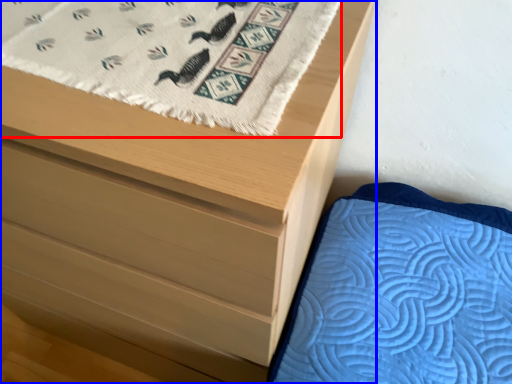
Question: Among these objects, which one is farthest to the camera, blanket (highlighted by a red box) or chest of drawers (highlighted by a blue box)?

Choices:
 (A) blanket
 (B) chest of drawers

Answer: (A)